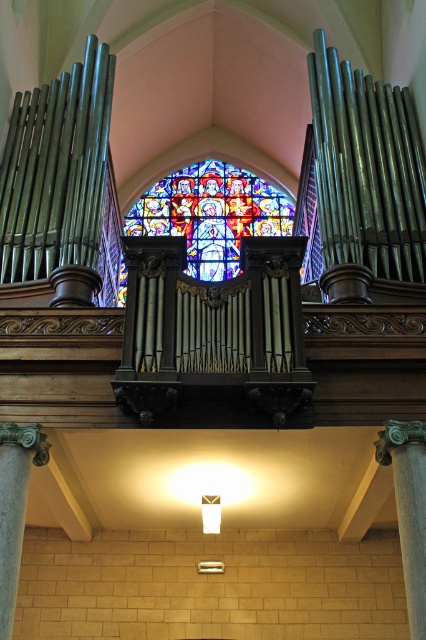
In the scene shown: Between polished silver pipes at upper right and green stone column at center, which one appears on the right side from the viewer's perspective?

Positioned to the right is polished silver pipes at upper right.

Based on the photo, does polished silver pipes at upper right appear on the left side of green stone column at center?

In fact, polished silver pipes at upper right is to the right of green stone column at center.

Locate an element on the screen. This screenshot has height=640, width=426. polished silver pipes at upper right is located at coordinates (367, 170).

Who is more forward, [199,212] or [409,605]?

Point [409,605]

Who is positioned more to the right, stained glass at center or green stone column at center?

green stone column at center

Between point (212, 228) and point (414, 429), which one is positioned in front?

Point (414, 429) is in front.

The width and height of the screenshot is (426, 640). Find the location of `stained glass at center`. stained glass at center is located at coordinates (210, 214).

Can you confirm if stained glass at center is bigger than gray stone column at lower left?

Yes.

Is stained glass at center positioned before gray stone column at lower left?

No.

The image size is (426, 640). Find the location of `stained glass at center`. stained glass at center is located at coordinates (210, 214).